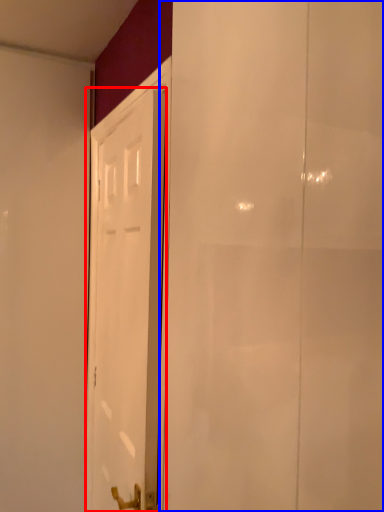
Question: Which of the following is the farthest to the observer, door (highlighted by a red box) or screen door (highlighted by a blue box)?

Choices:
 (A) door
 (B) screen door

Answer: (A)